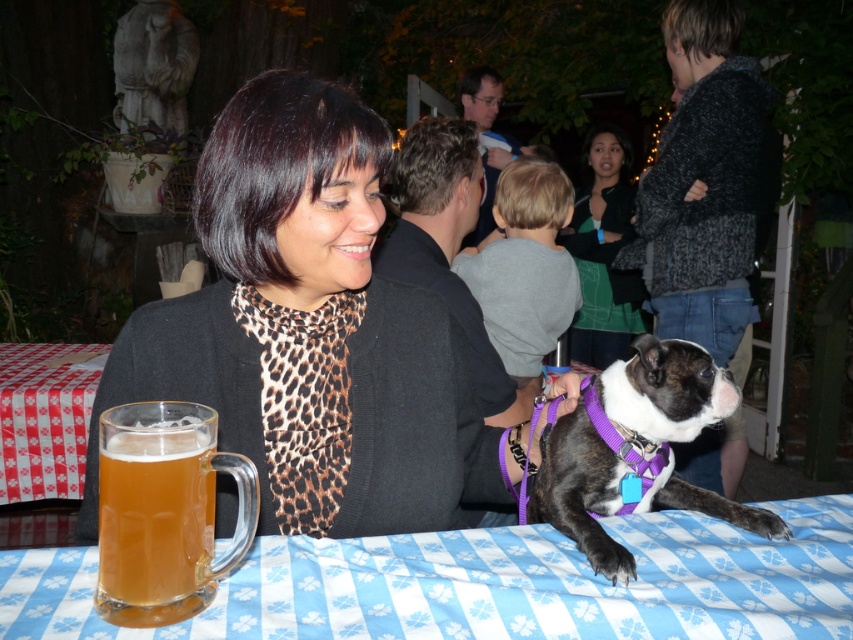
Question: Does translucent glass mug at lower left have a smaller size compared to leopard print scarf at center?

Choices:
 (A) yes
 (B) no

Answer: (A)

Question: Estimate the real-world distances between objects in this image. Which object is closer to the blue/white checkered tablecloth at lower center?

Choices:
 (A) translucent glass mug at lower left
 (B) leopard print scarf at center

Answer: (A)

Question: Is matte black sweater at center positioned at the back of blue/white checkered tablecloth at lower center?

Choices:
 (A) yes
 (B) no

Answer: (A)

Question: Which point appears farthest from the camera in this image?

Choices:
 (A) (618, 621)
 (B) (592, 180)

Answer: (B)

Question: Among these points, which one is nearest to the camera?

Choices:
 (A) (622, 275)
 (B) (689, 384)
 (C) (532, 298)
 (D) (631, 621)

Answer: (D)

Question: Can you confirm if gray cotton shirt at center is smaller than red checkered fabric at lower left?

Choices:
 (A) no
 (B) yes

Answer: (B)